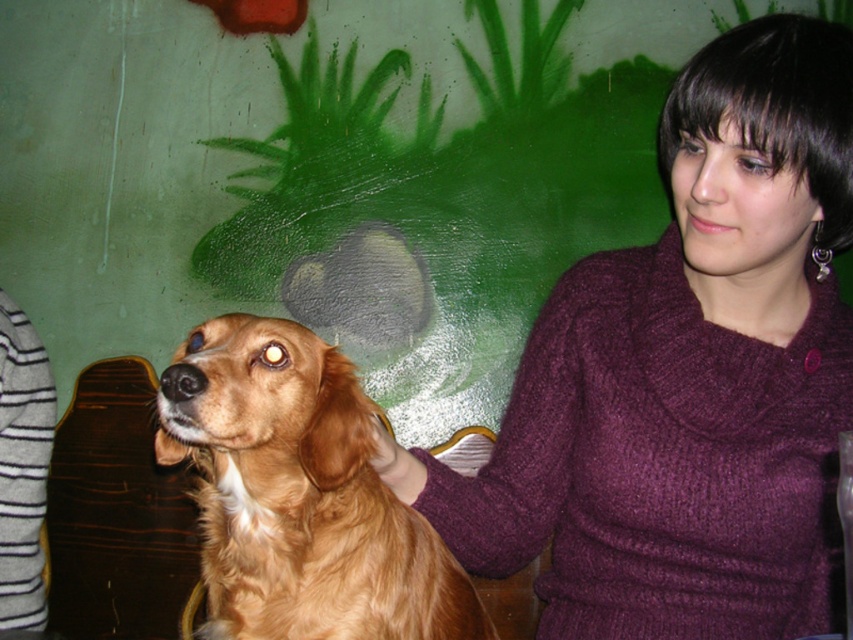
Question: Can you confirm if knitted purple sweater at center is positioned to the right of golden fur dog at center?

Choices:
 (A) yes
 (B) no

Answer: (A)

Question: Is knitted purple sweater at center smaller than golden fur dog at center?

Choices:
 (A) yes
 (B) no

Answer: (B)

Question: Does knitted purple sweater at center appear on the left side of golden fur dog at center?

Choices:
 (A) yes
 (B) no

Answer: (B)